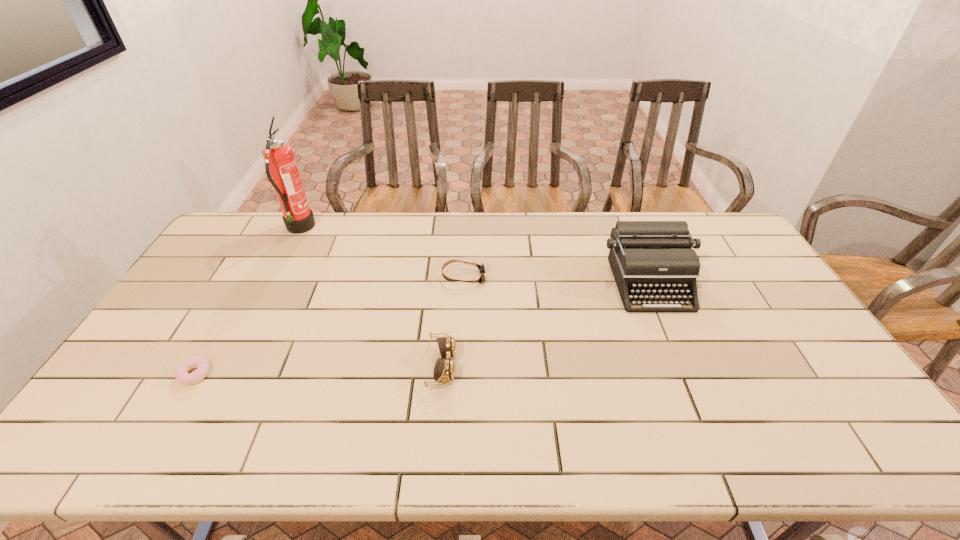
Find the location of a particular element. This screenshot has height=540, width=960. the farthest object is located at coordinates (281, 168).

What are the coordinates of `fire extinguisher` in the screenshot? It's located at (281, 168).

Where is `the fourth shortest object`? the fourth shortest object is located at coordinates (646, 257).

Locate an element on the screen. typewriter is located at coordinates (646, 257).

Locate an element on the screen. This screenshot has height=540, width=960. the third shortest object is located at coordinates (444, 369).

Find the location of `the nearer goggles`. the nearer goggles is located at coordinates (444, 369).

Identify the location of the second shortest object. The width and height of the screenshot is (960, 540). (482, 269).

The width and height of the screenshot is (960, 540). I want to click on the farther goggles, so click(x=482, y=269).

This screenshot has height=540, width=960. What are the coordinates of `doughnut` in the screenshot? It's located at (201, 363).

Where is `free space located on the front-facing side of the tallest object`? This screenshot has width=960, height=540. free space located on the front-facing side of the tallest object is located at coordinates (381, 229).